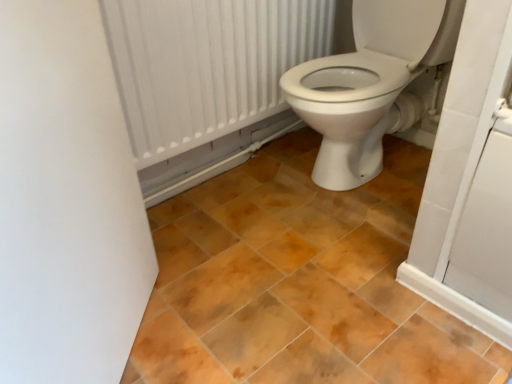
This screenshot has width=512, height=384. What are the coordinates of `white textured radiator at upper center` in the screenshot? It's located at pos(207,65).

Describe the element at coordinates (207, 65) in the screenshot. I see `white textured radiator at upper center` at that location.

The height and width of the screenshot is (384, 512). What are the coordinates of `brown matte tile at center` in the screenshot? It's located at (298, 281).

Describe the element at coordinates (298, 281) in the screenshot. This screenshot has width=512, height=384. I see `brown matte tile at center` at that location.

I want to click on white textured radiator at upper center, so click(x=207, y=65).

Which object is positioned more to the right, white textured radiator at upper center or brown matte tile at center?

From the viewer's perspective, brown matte tile at center appears more on the right side.

Is the position of white textured radiator at upper center less distant than that of brown matte tile at center?

That is False.

Which is closer to the camera, (253, 50) or (179, 351)?

The point (179, 351) is closer to the camera.

From the image's perspective, between white textured radiator at upper center and brown matte tile at center, who is located below?

brown matte tile at center appears lower in the image.

From a real-world perspective, is white textured radiator at upper center on top of brown matte tile at center?

Yes, from a real-world perspective, white textured radiator at upper center is above brown matte tile at center.

Is white textured radiator at upper center thinner than brown matte tile at center?

Correct, the width of white textured radiator at upper center is less than that of brown matte tile at center.

Considering the sizes of objects white textured radiator at upper center and brown matte tile at center in the image provided, who is taller, white textured radiator at upper center or brown matte tile at center?

white textured radiator at upper center.

In the scene shown: Can you confirm if white textured radiator at upper center is smaller than brown matte tile at center?

Yes.

Is white textured radiator at upper center located outside brown matte tile at center?

Indeed, white textured radiator at upper center is completely outside brown matte tile at center.

Is white textured radiator at upper center positioned far away from brown matte tile at center?

No, there isn't a large distance between white textured radiator at upper center and brown matte tile at center.

Is white textured radiator at upper center facing towards brown matte tile at center?

No, white textured radiator at upper center is not aimed at brown matte tile at center.

This screenshot has width=512, height=384. Find the location of `radiator behind the brown matte tile at center`. radiator behind the brown matte tile at center is located at coordinates (207, 65).

Is brown matte tile at center at the left side of white textured radiator at upper center?

No, brown matte tile at center is not to the left of white textured radiator at upper center.

Who is more distant, brown matte tile at center or white textured radiator at upper center?

Positioned behind is white textured radiator at upper center.

Which is closer, [224,229] or [200,110]?

Clearly, point [224,229] is more distant from the camera than point [200,110].

From the picture: From the image's perspective, would you say brown matte tile at center is positioned over white textured radiator at upper center?

Incorrect, from the image's perspective, brown matte tile at center is lower than white textured radiator at upper center.

From a real-world perspective, is brown matte tile at center positioned over white textured radiator at upper center based on gravity?

No, from a real-world perspective, brown matte tile at center is not on top of white textured radiator at upper center.

Is brown matte tile at center thinner than white textured radiator at upper center?

Incorrect, the width of brown matte tile at center is not less than that of white textured radiator at upper center.

Considering the relative sizes of brown matte tile at center and white textured radiator at upper center in the image provided, is brown matte tile at center taller than white textured radiator at upper center?

In fact, brown matte tile at center may be shorter than white textured radiator at upper center.

Does brown matte tile at center have a smaller size compared to white textured radiator at upper center?

Actually, brown matte tile at center might be larger than white textured radiator at upper center.

Is brown matte tile at center not inside white textured radiator at upper center?

brown matte tile at center lies outside white textured radiator at upper center's area.

Is brown matte tile at center far away from white textured radiator at upper center?

That's not correct — brown matte tile at center is a little close to white textured radiator at upper center.

Is brown matte tile at center facing away from white textured radiator at upper center?

No, brown matte tile at center is not facing the opposite direction of white textured radiator at upper center.

Where is `ceramic tile on the right of the white textured radiator at upper center`? ceramic tile on the right of the white textured radiator at upper center is located at coordinates (298, 281).

Identify the location of radiator that appears on the left of brown matte tile at center. (207, 65).

The height and width of the screenshot is (384, 512). Find the location of `ceramic tile that appears in front of the white textured radiator at upper center`. ceramic tile that appears in front of the white textured radiator at upper center is located at coordinates (298, 281).